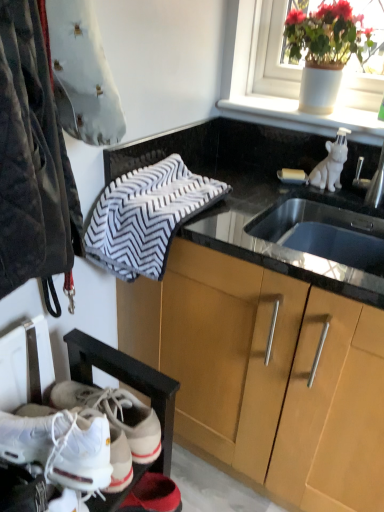
At what (x,y) coordinates should I click in order to perform the action: click on free location to the left of white glossy ceramic dog at upper right, the 2th animal from the front. Please return your answer as a coordinate pair (x, y). Looking at the image, I should click on (273, 182).